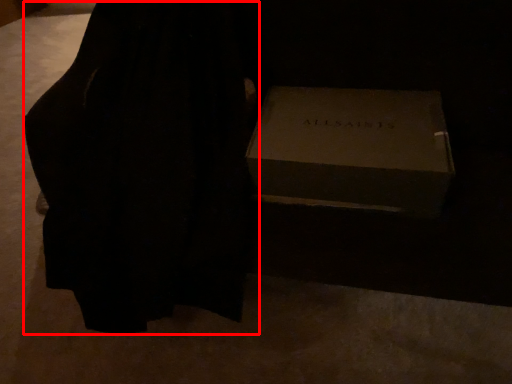
Question: From the image's perspective, what is the correct spatial positioning of dress (annotated by the red box) in reference to box?

Choices:
 (A) below
 (B) above

Answer: (B)